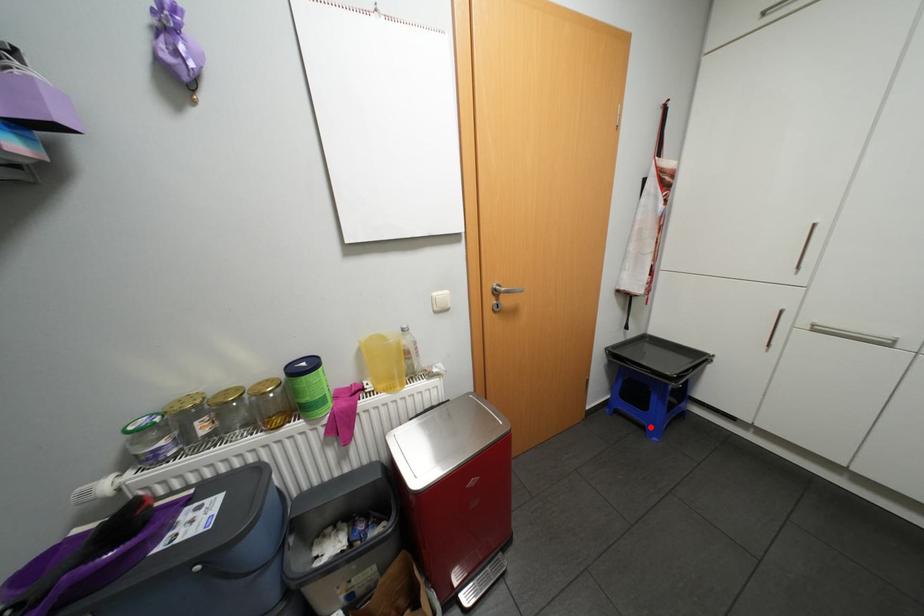
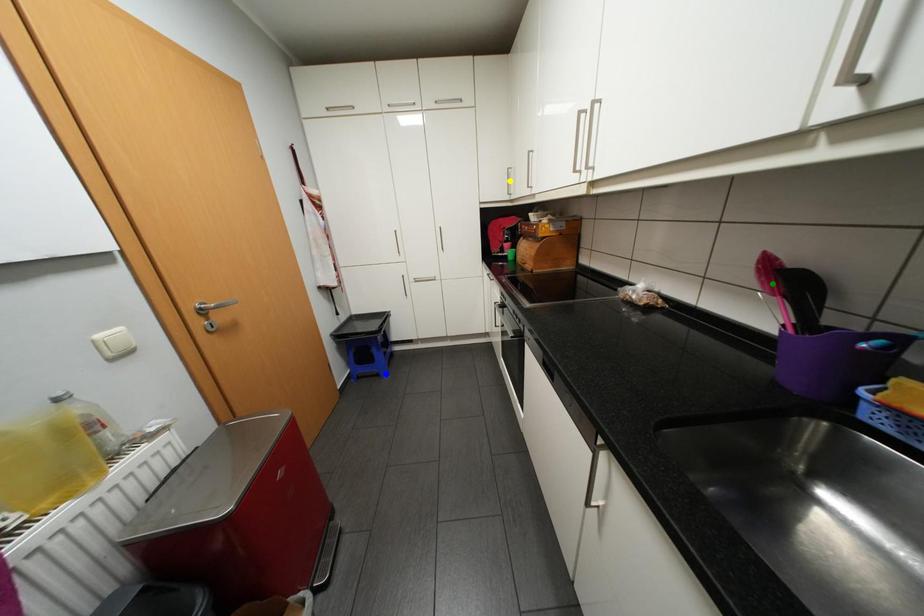
Question: I am providing you with two images of the same scene from different viewpoints. A red point is marked on the first image. You are given multiple points on the second image. Which point in image 2 represents the same 3d spot as the red point in image 1?

Choices:
 (A) yellow point
 (B) blue point
 (C) green point

Answer: (B)